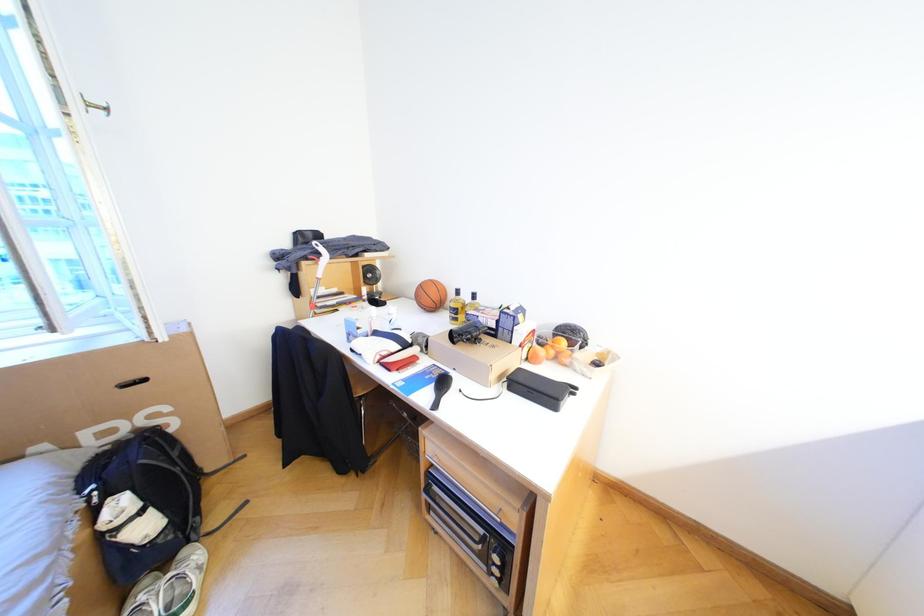
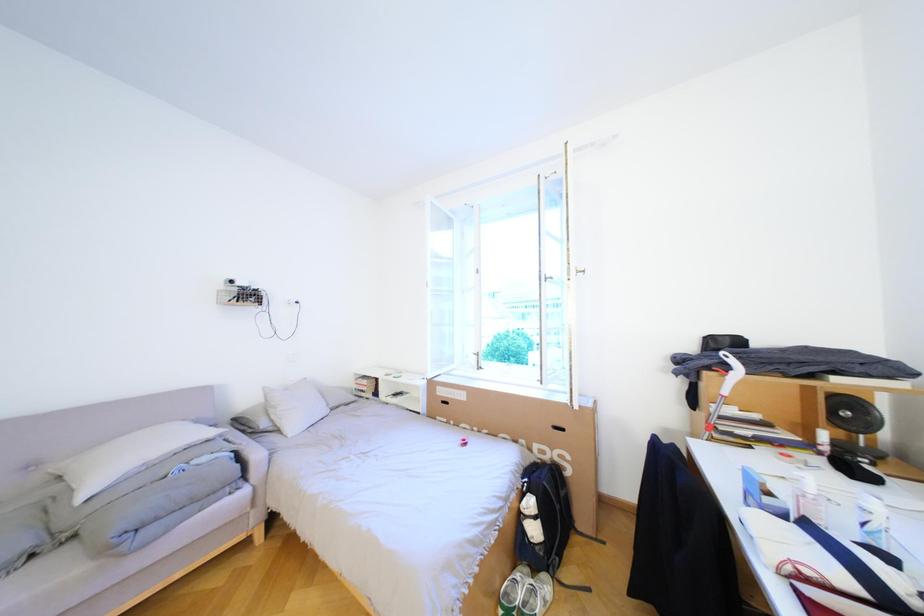
Question: The camera is either moving clockwise (left) or counter-clockwise (right) around the object. The first image is from the beginning of the video and the second image is from the end. Is the camera moving left or right when shooting the video?

Choices:
 (A) Left
 (B) Right

Answer: (B)